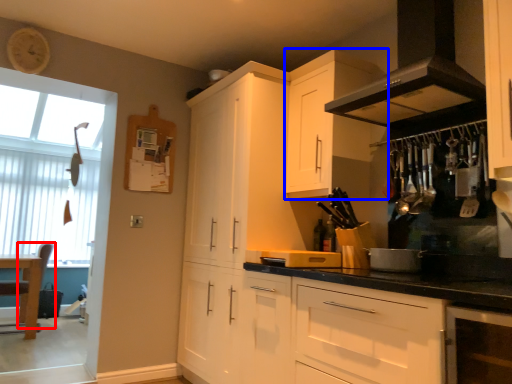
Question: Which of the following is the closest to the observer, chair (highlighted by a red box) or cabinetry (highlighted by a blue box)?

Choices:
 (A) chair
 (B) cabinetry

Answer: (B)